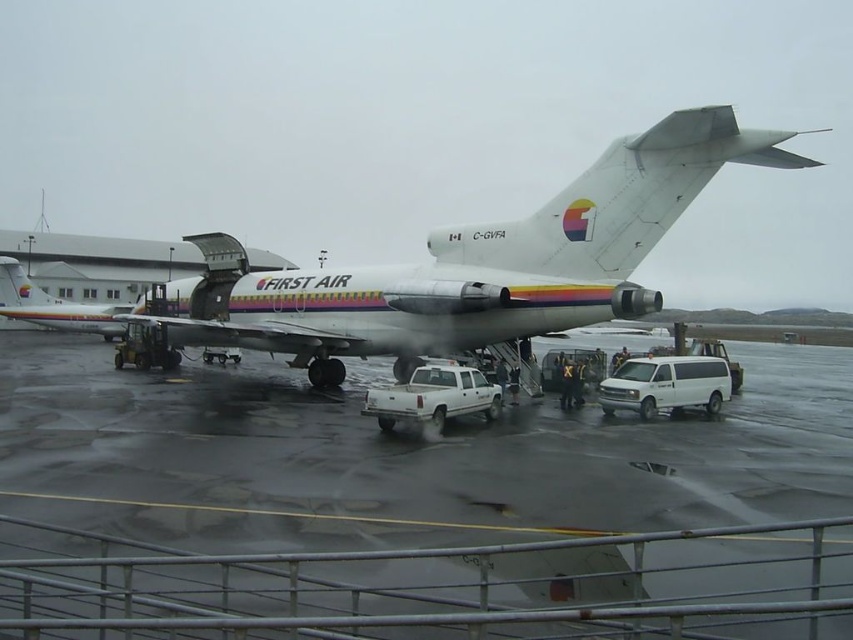
Which of these two, white matte truck at center or matte white airplane at left, stands shorter?

Standing shorter between the two is white matte truck at center.

At what (x,y) coordinates should I click in order to perform the action: click on white matte truck at center. Please return your answer as a coordinate pair (x, y). Looking at the image, I should click on (433, 397).

The width and height of the screenshot is (853, 640). I want to click on white matte truck at center, so click(x=433, y=397).

Does shiny asphalt tarmac at center have a lesser width compared to white matte airplane at center?

Yes.

Does shiny asphalt tarmac at center have a smaller size compared to white matte airplane at center?

Yes, shiny asphalt tarmac at center is smaller than white matte airplane at center.

The height and width of the screenshot is (640, 853). Identify the location of shiny asphalt tarmac at center. (415, 508).

Is the position of white matte airplane at center more distant than that of matte white airplane at left?

No, white matte airplane at center is in front of matte white airplane at left.

Consider the image. Is white matte airplane at center bigger than matte white airplane at left?

Indeed, white matte airplane at center has a larger size compared to matte white airplane at left.

Who is more forward, (241, 262) or (102, 333)?

Point (241, 262)

Locate an element on the screen. Image resolution: width=853 pixels, height=640 pixels. white matte airplane at center is located at coordinates (483, 262).